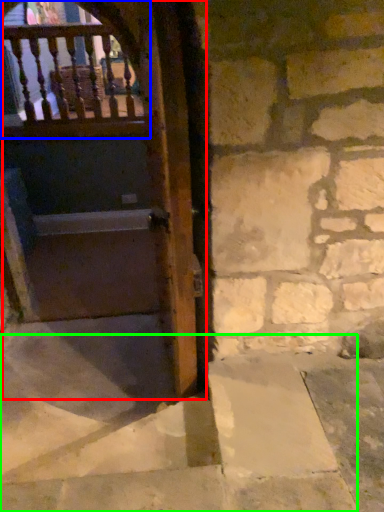
Question: Considering the real-world distances, which object is closest to door (highlighted by a red box)? balcony (highlighted by a blue box) or stairwell (highlighted by a green box).

Choices:
 (A) balcony
 (B) stairwell

Answer: (A)